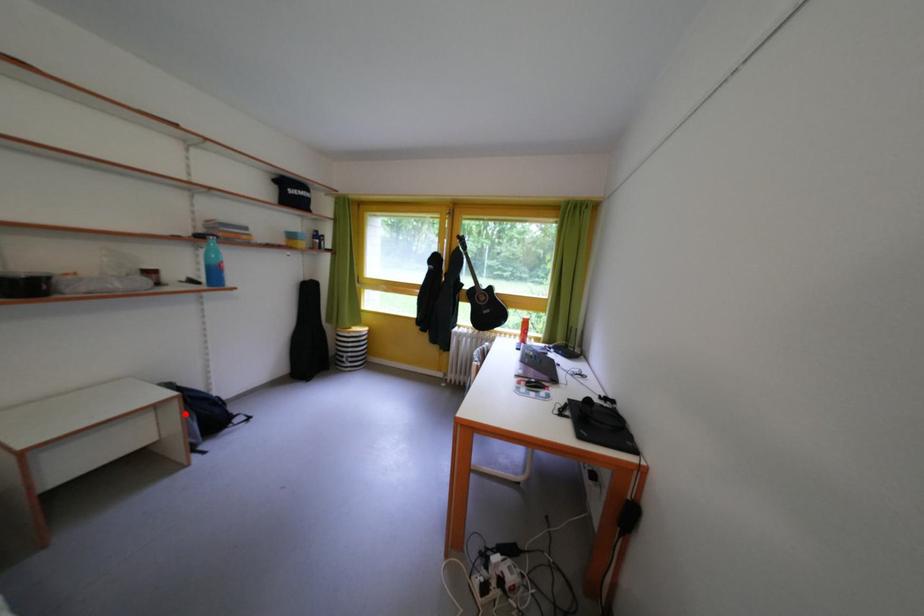
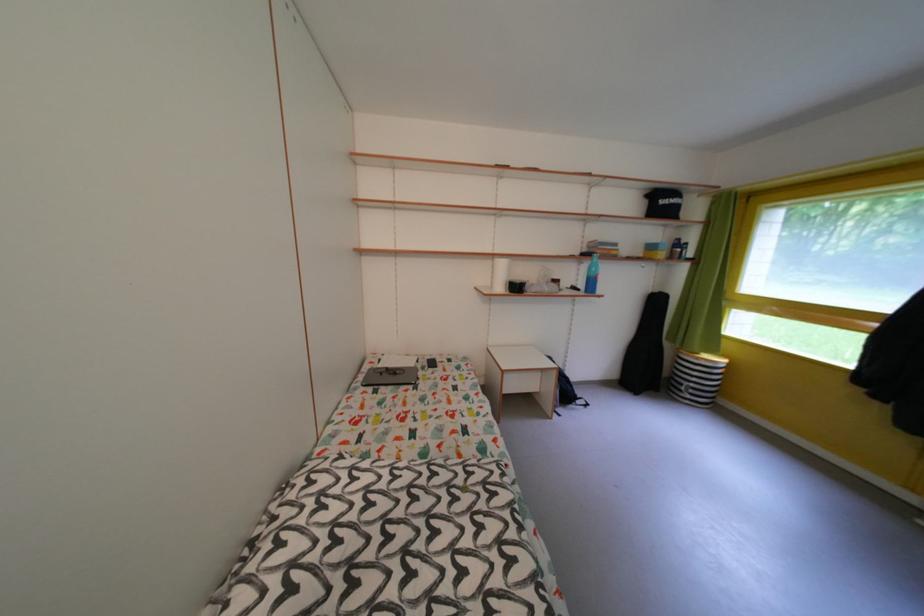
Question: I am providing you with two images of the same scene from different viewpoints. Given a red point in image1, look at the same physical point in image2. Is it:

Choices:
 (A) Closer to the viewpoint
 (B) Farther from the viewpoint

Answer: (B)